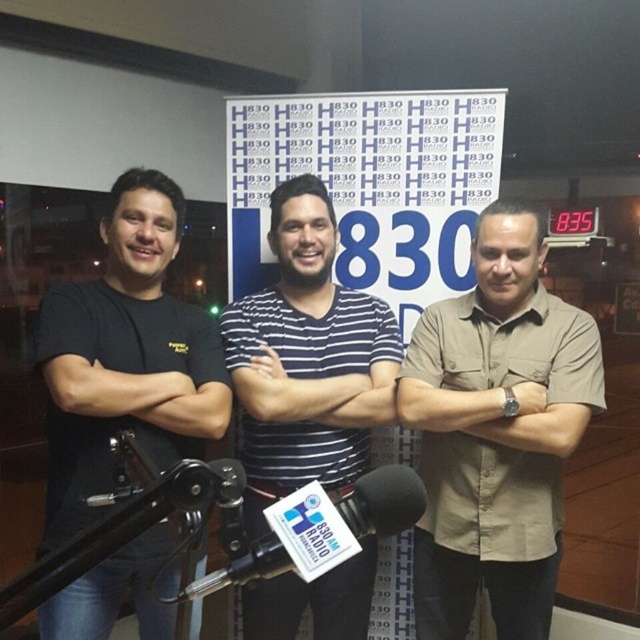
Question: Which point is farther from the camera taking this photo?

Choices:
 (A) click(x=44, y=628)
 (B) click(x=440, y=540)

Answer: (B)

Question: Does white striped shirt at center appear over striped fabric at center?

Choices:
 (A) no
 (B) yes

Answer: (A)

Question: Is the position of beige button-down shirt at center less distant than that of white striped shirt at center?

Choices:
 (A) no
 (B) yes

Answer: (B)

Question: Which object is farther from the camera taking this photo?

Choices:
 (A) beige fabric shirt at center
 (B) white striped shirt at center
 (C) striped fabric at center

Answer: (B)

Question: Among these points, which one is farthest from the camera?

Choices:
 (A) (163, 243)
 (B) (424, 333)
 (C) (273, 433)
 (D) (275, 378)

Answer: (B)

Question: Can you confirm if beige fabric shirt at center is positioned to the left of striped fabric at center?

Choices:
 (A) yes
 (B) no

Answer: (B)